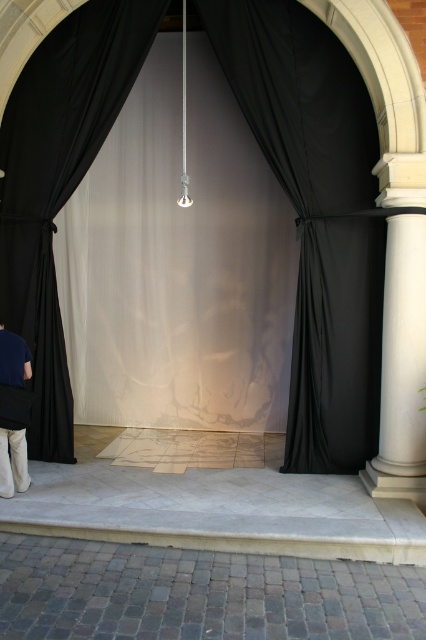
Question: Is black silk curtain at center further to the viewer compared to white marble stage at center?

Choices:
 (A) yes
 (B) no

Answer: (A)

Question: Which object is farther from the camera taking this photo?

Choices:
 (A) black fabric curtain at left
 (B) white marble stage at center
 (C) black fabric curtain at center

Answer: (A)

Question: Is black fabric curtain at center wider than black fabric curtain at left?

Choices:
 (A) no
 (B) yes

Answer: (A)

Question: Which point is closer to the camera?

Choices:
 (A) (307, 548)
 (B) (29, 266)

Answer: (A)

Question: Can you confirm if white marble stage at center is thinner than black fabric curtain at left?

Choices:
 (A) yes
 (B) no

Answer: (B)

Question: Which object is positioned closest to the black silk curtain at center?

Choices:
 (A) black fabric curtain at left
 (B) black fabric curtain at center
 (C) white marble stage at center

Answer: (B)